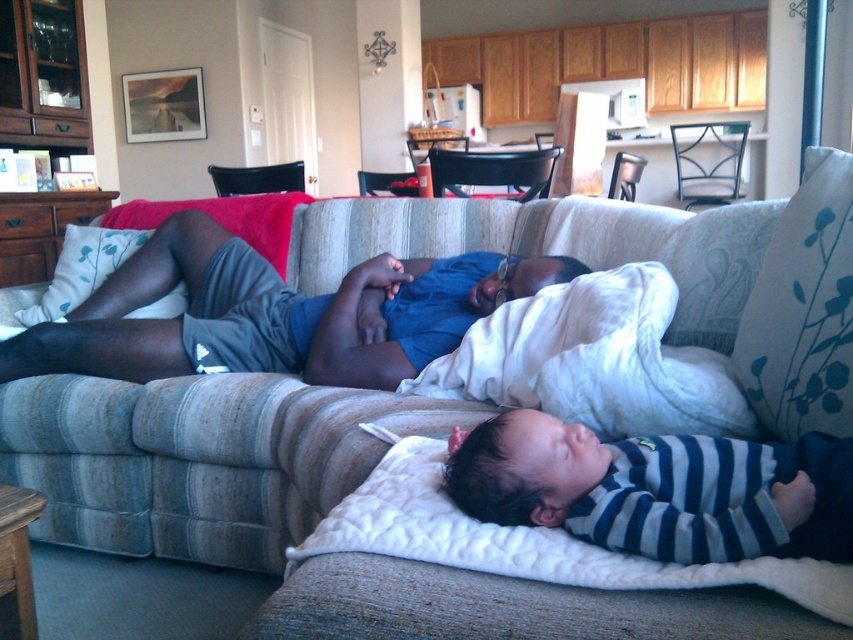
Question: Which of the following is the closest to the observer?

Choices:
 (A) striped fabric baby at lower right
 (B) striped cotton onesie at center

Answer: (A)

Question: Which object appears farthest from the camera in this image?

Choices:
 (A) striped cotton onesie at center
 (B) white plush blanket at lower center

Answer: (A)

Question: Can you confirm if striped cotton onesie at center is smaller than white plush blanket at lower center?

Choices:
 (A) yes
 (B) no

Answer: (B)

Question: In this image, where is striped cotton onesie at center located relative to striped fabric baby at lower right?

Choices:
 (A) left
 (B) right

Answer: (A)

Question: Estimate the real-world distances between objects in this image. Which object is closer to the striped fabric baby at lower right?

Choices:
 (A) striped cotton onesie at center
 (B) white plush blanket at lower center

Answer: (B)

Question: From the image, what is the correct spatial relationship of striped fabric baby at lower right in relation to white plush blanket at lower center?

Choices:
 (A) left
 (B) right

Answer: (B)